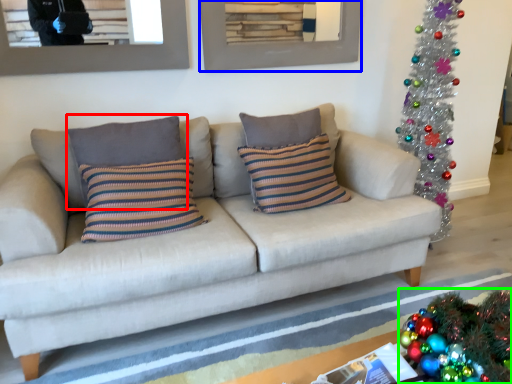
Question: Based on their relative distances, which object is farther from pillow (highlighted by a red box)? Choose from picture frame (highlighted by a blue box) and christmas decoration (highlighted by a green box).

Choices:
 (A) picture frame
 (B) christmas decoration

Answer: (B)